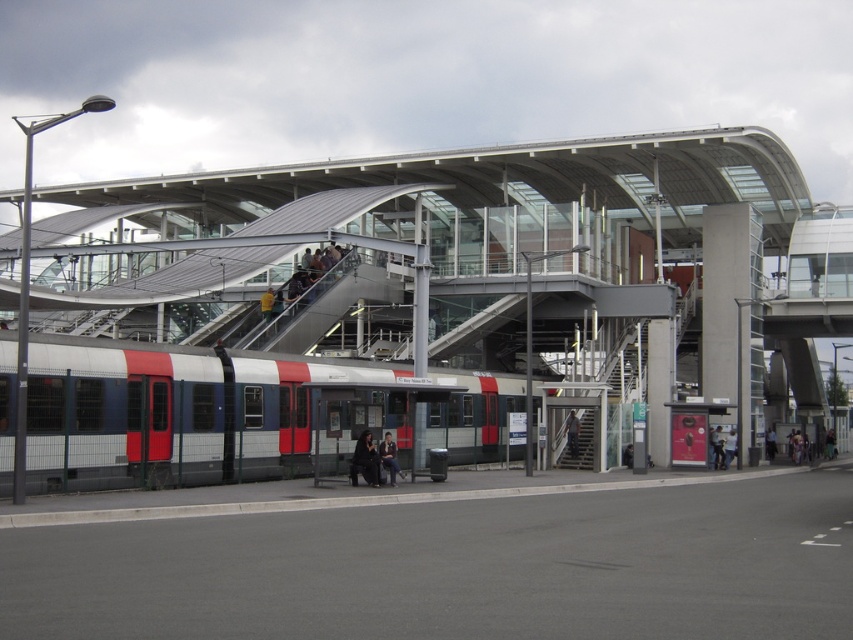
Between metallic train at left and metallic gray staircase at center, which one is positioned lower?

metallic gray staircase at center

Between point (427, 433) and point (554, 452), which one is positioned in front?

Point (427, 433) is in front.

What do you see at coordinates (426, 291) in the screenshot? I see `metallic train at left` at bounding box center [426, 291].

Where is `metallic train at left`? metallic train at left is located at coordinates (426, 291).

Does red and white metal train at center have a smaller size compared to metallic gray staircase at center?

Incorrect, red and white metal train at center is not smaller in size than metallic gray staircase at center.

Can you confirm if red and white metal train at center is positioned above metallic gray staircase at center?

Incorrect, red and white metal train at center is not positioned above metallic gray staircase at center.

Find the location of a particular element. The image size is (853, 640). red and white metal train at center is located at coordinates (239, 413).

Is metallic train at left positioned at the back of red and white metal train at center?

That is False.

Is metallic train at left positioned in front of red and white metal train at center?

Yes, metallic train at left is in front of red and white metal train at center.

The height and width of the screenshot is (640, 853). I want to click on metallic train at left, so click(x=426, y=291).